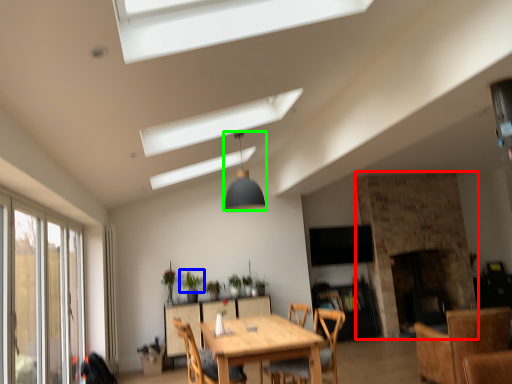
Question: Which object is positioned farthest from fireplace (highlighted by a red box)? Select from plant (highlighted by a blue box) and light fixture (highlighted by a green box).

Choices:
 (A) plant
 (B) light fixture

Answer: (A)